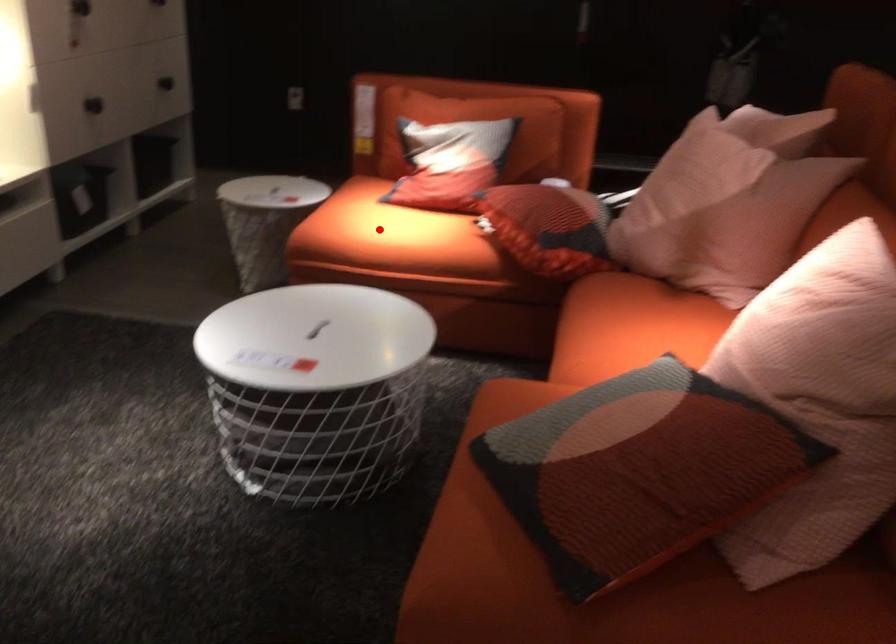
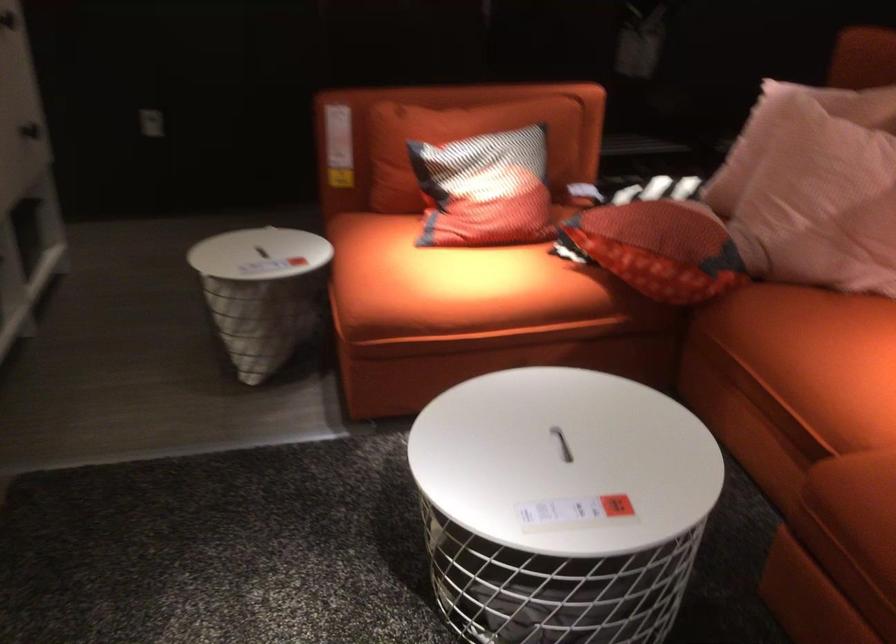
Locate, in the second image, the point that corresponds to the highlighted location in the first image.

(449, 281)